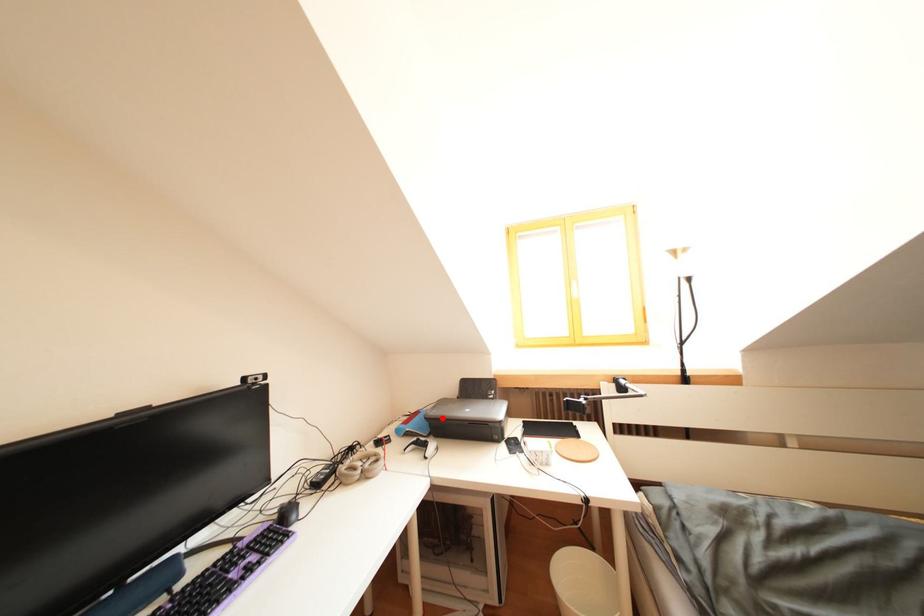
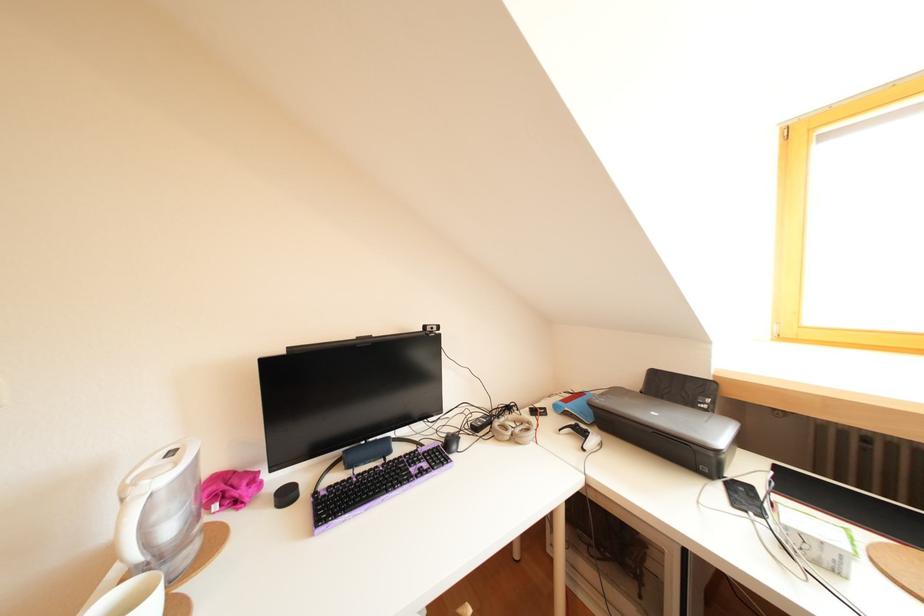
Where in the second image is the point corresponding to the highlighted location from the first image?

(610, 407)